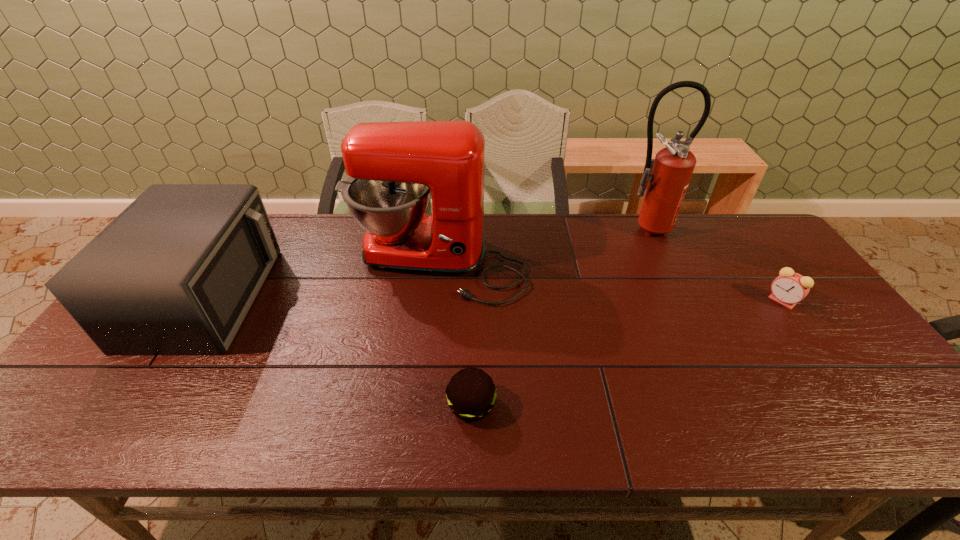
At what (x,y) coordinates should I click in order to perform the action: click on vacant area that satisfies the following two spatial constraints: 1. at the nozzle of the fire extinguisher; 2. on the front-facing side of the microwave oven. Please return your answer as a coordinate pair (x, y). Looking at the image, I should click on (677, 297).

Where is `free location that satisfies the following two spatial constraints: 1. on the front-facing side of the leftmost object; 2. on the left side of the nearest object`? The width and height of the screenshot is (960, 540). free location that satisfies the following two spatial constraints: 1. on the front-facing side of the leftmost object; 2. on the left side of the nearest object is located at coordinates (135, 406).